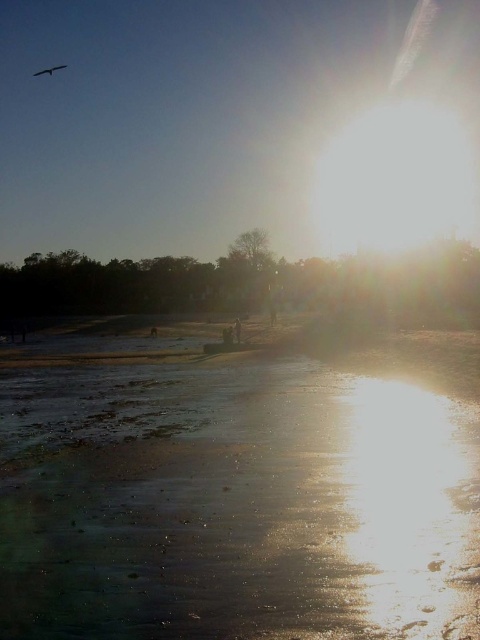
Is shiny sand at lower center thinner than silvery metallic bird at upper left?

In fact, shiny sand at lower center might be wider than silvery metallic bird at upper left.

Does shiny sand at lower center have a greater width compared to silvery metallic bird at upper left?

Yes.

Locate an element on the screen. The height and width of the screenshot is (640, 480). shiny sand at lower center is located at coordinates (232, 496).

You are a GUI agent. You are given a task and a screenshot of the screen. Output one action in this format:
    pyautogui.click(x=<x>, y=<y>)
    Task: Click on the shiny sand at lower center
    The width and height of the screenshot is (480, 640).
    Given the screenshot: What is the action you would take?
    pyautogui.click(x=232, y=496)